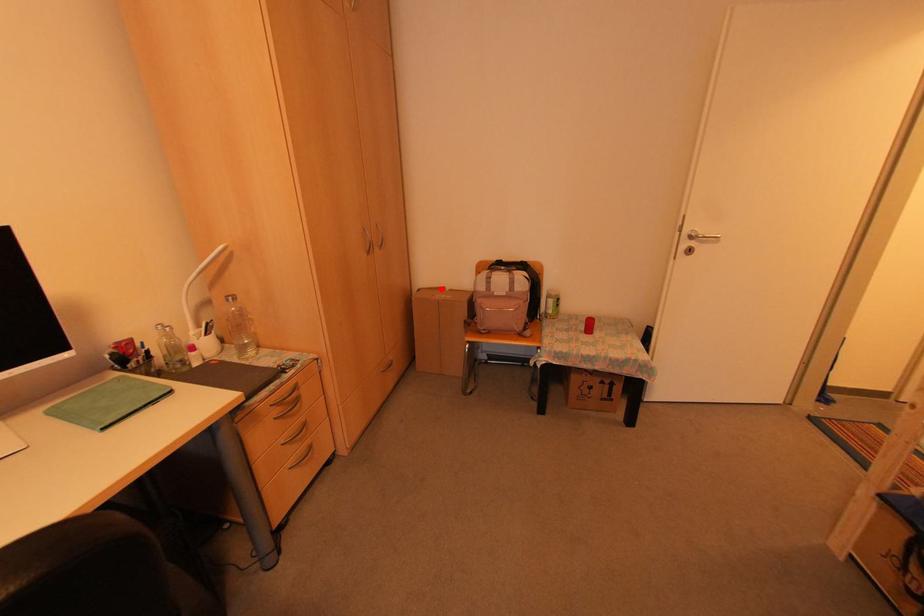
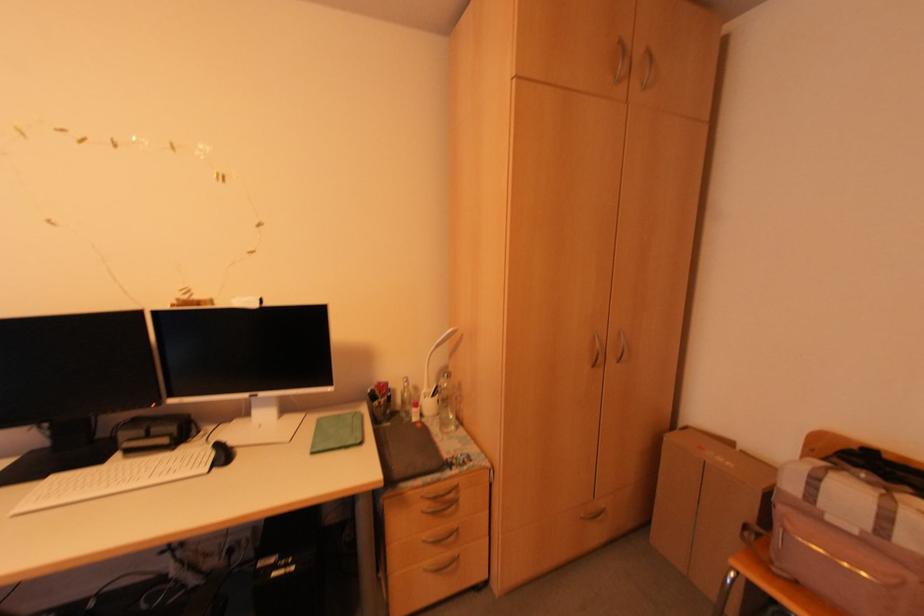
In the second image, find the point that corresponds to the highlighted location in the first image.

(728, 444)